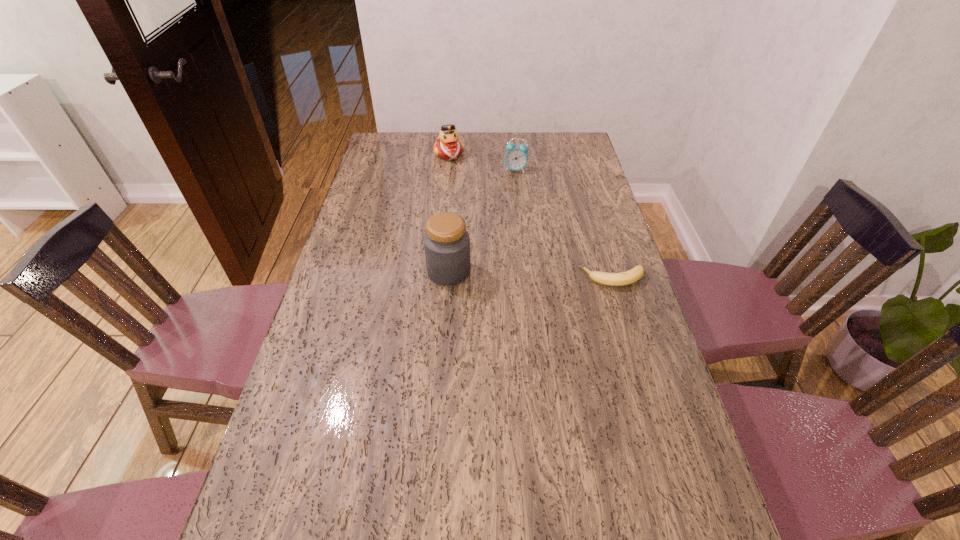
Find the location of a particular element. The image size is (960, 540). free space that is in between the tallest object and the third object from left to right is located at coordinates (482, 221).

Where is `unoccupied area between the third object from left to right and the jar`? Image resolution: width=960 pixels, height=540 pixels. unoccupied area between the third object from left to right and the jar is located at coordinates (482, 221).

Identify the location of empty space that is in between the banana and the second farthest object. (564, 224).

Locate an element on the screen. object that can be found as the third closest to the jar is located at coordinates (448, 147).

Point out which object is positioned as the second nearest to the second farthest object. Please provide its 2D coordinates. Your answer should be formatted as a tuple, i.e. [(x, y)], where the tuple contains the x and y coordinates of a point satisfying the conditions above.

[(446, 242)]

Locate an element on the screen. vacant region that satisfies the following two spatial constraints: 1. on the front side of the third nearest object; 2. on the right side of the duck is located at coordinates (447, 170).

Identify the location of vacant space that satisfies the following two spatial constraints: 1. on the front side of the farthest object; 2. on the right side of the third nearest object. (447, 170).

Find the location of a particular element. free space that satisfies the following two spatial constraints: 1. on the front side of the tallest object; 2. on the surface of the farthest object near the warning symbol is located at coordinates 438,272.

I want to click on vacant area in the image that satisfies the following two spatial constraints: 1. on the front side of the farthest object; 2. at the stem of the rightmost object, so click(437, 278).

The width and height of the screenshot is (960, 540). What are the coordinates of `free spot that satisfies the following two spatial constraints: 1. on the front side of the second farthest object; 2. at the stem of the shortest object` in the screenshot? It's located at (527, 278).